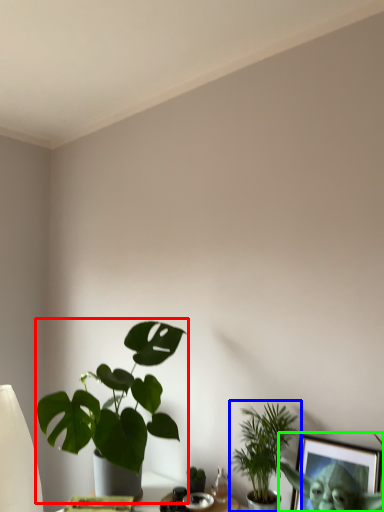
Question: Which object is the closest to the houseplant (highlighted by a red box)? Choose among these: houseplant (highlighted by a blue box) or picture frame (highlighted by a green box).

Choices:
 (A) houseplant
 (B) picture frame

Answer: (A)